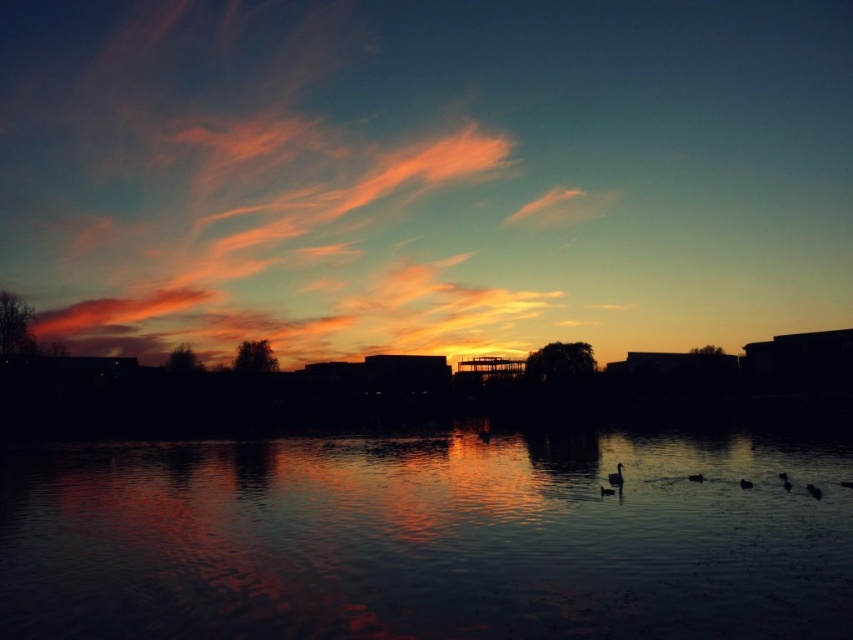
Question: Does black matte duck at center come in front of dark gray matte duck at lower right?

Choices:
 (A) yes
 (B) no

Answer: (B)

Question: Which of the following is the closest to the observer?

Choices:
 (A) (608, 480)
 (B) (694, 474)
 (C) (438, 499)
 (D) (744, 486)

Answer: (C)

Question: Which point is farther from the camera taking this photo?

Choices:
 (A) click(688, 477)
 (B) click(747, 483)
 (C) click(616, 476)

Answer: (A)

Question: Among these points, which one is farthest from the camera?

Choices:
 (A) (303, 531)
 (B) (689, 481)
 (C) (747, 488)

Answer: (B)

Question: Is glossy reflective water at center to the right of dark gray matte duck at lower right from the viewer's perspective?

Choices:
 (A) no
 (B) yes

Answer: (A)

Question: Does black matte duck at center appear over dark gray matte duck at lower right?

Choices:
 (A) no
 (B) yes

Answer: (B)